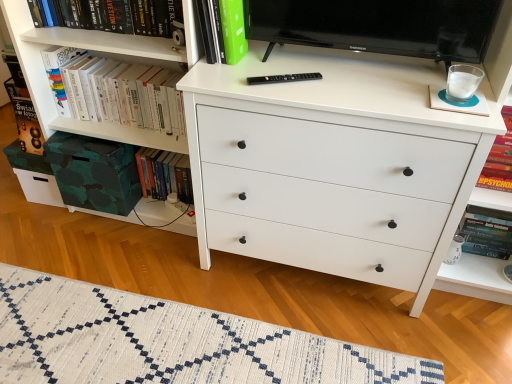
Question: Considering the relative positions of green matte book at upper center, which ranks as the 2th book in right-to-left order, and white matte chest of drawers at center in the image provided, is green matte book at upper center, which ranks as the 2th book in right-to-left order, to the right of white matte chest of drawers at center from the viewer's perspective?

Choices:
 (A) no
 (B) yes

Answer: (A)

Question: From the image's perspective, is green matte book at upper center, the third book positioned from the left, located beneath white matte chest of drawers at center?

Choices:
 (A) yes
 (B) no

Answer: (B)

Question: From the image's perspective, is green matte book at upper center, which ranks as the 2th book in right-to-left order, over white matte chest of drawers at center?

Choices:
 (A) no
 (B) yes

Answer: (B)

Question: From a real-world perspective, does green matte book at upper center, which ranks as the 2th book in right-to-left order, stand above white matte chest of drawers at center?

Choices:
 (A) yes
 (B) no

Answer: (A)

Question: Is green matte book at upper center, which ranks as the 2th book in right-to-left order, far from white matte chest of drawers at center?

Choices:
 (A) yes
 (B) no

Answer: (B)

Question: From a real-world perspective, does green matte book at upper center, which ranks as the 2th book in right-to-left order, sit lower than white matte chest of drawers at center?

Choices:
 (A) yes
 (B) no

Answer: (B)

Question: Considering the relative positions of hardcover book at lower left, the 2th book when ordered from left to right, and black glossy television at upper center in the image provided, is hardcover book at lower left, the 2th book when ordered from left to right, to the right of black glossy television at upper center from the viewer's perspective?

Choices:
 (A) no
 (B) yes

Answer: (A)

Question: Is the position of hardcover book at lower left, the 3th book in the right-to-left sequence, less distant than that of black glossy television at upper center?

Choices:
 (A) no
 (B) yes

Answer: (A)

Question: Considering the relative sizes of hardcover book at lower left, the 2th book when ordered from left to right, and black glossy television at upper center in the image provided, is hardcover book at lower left, the 2th book when ordered from left to right, bigger than black glossy television at upper center?

Choices:
 (A) no
 (B) yes

Answer: (A)

Question: Can you confirm if hardcover book at lower left, the 3th book in the right-to-left sequence, is taller than black glossy television at upper center?

Choices:
 (A) yes
 (B) no

Answer: (A)

Question: Does hardcover book at lower left, the 2th book when ordered from left to right, appear on the left side of black glossy television at upper center?

Choices:
 (A) yes
 (B) no

Answer: (A)

Question: Is hardcover books at upper left closer to camera compared to green matte book at upper center, which ranks as the 2th book in right-to-left order?

Choices:
 (A) no
 (B) yes

Answer: (A)